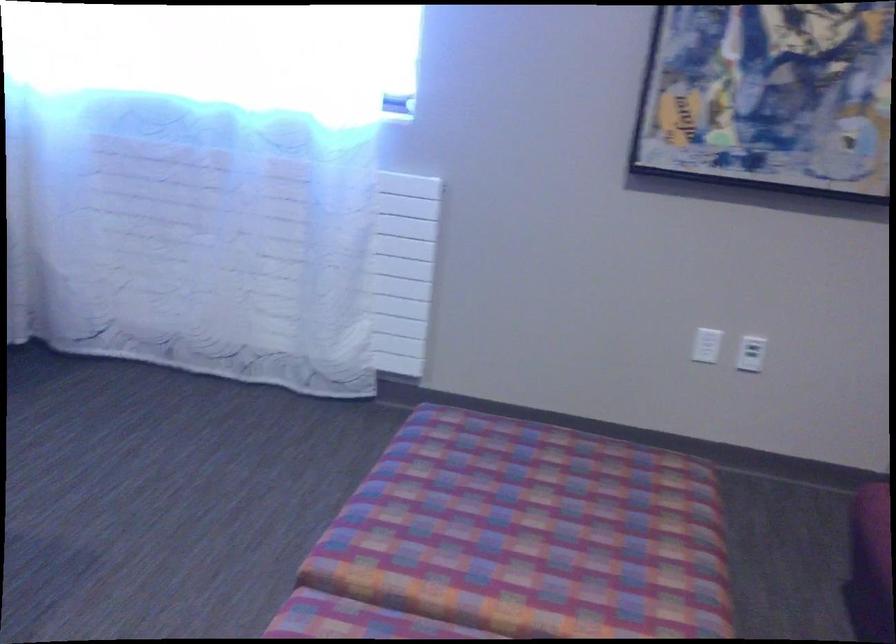
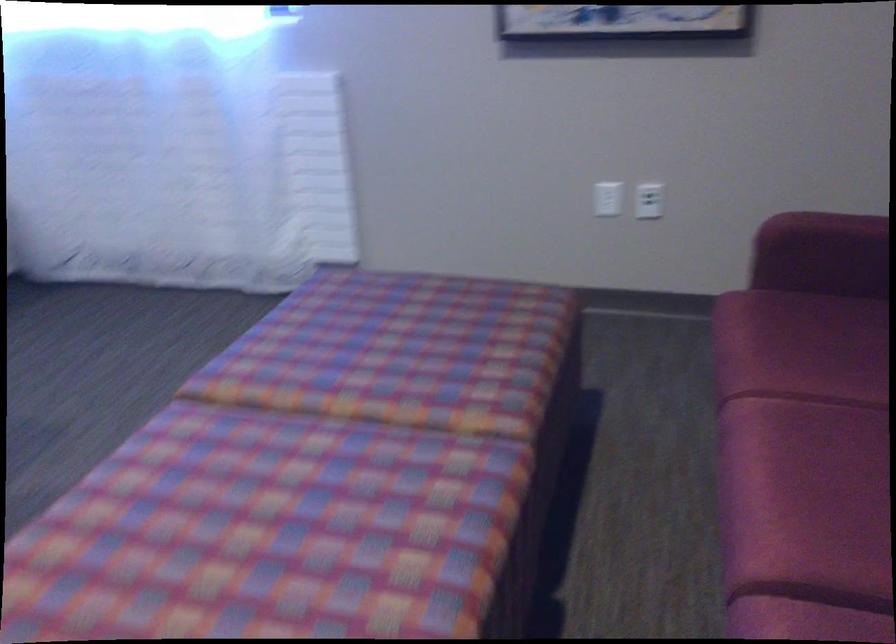
The images are taken continuously from a first-person perspective. In which direction are you moving?

The cameraman walked toward right, backward.